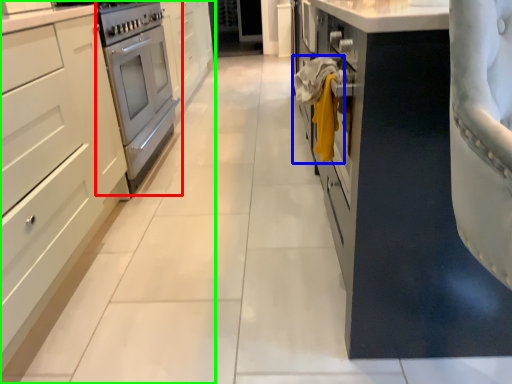
Question: Based on their relative distances, which object is nearer to home appliance (highlighted by a red box)? Choose from laundry (highlighted by a blue box) and cabinetry (highlighted by a green box).

Choices:
 (A) laundry
 (B) cabinetry

Answer: (B)